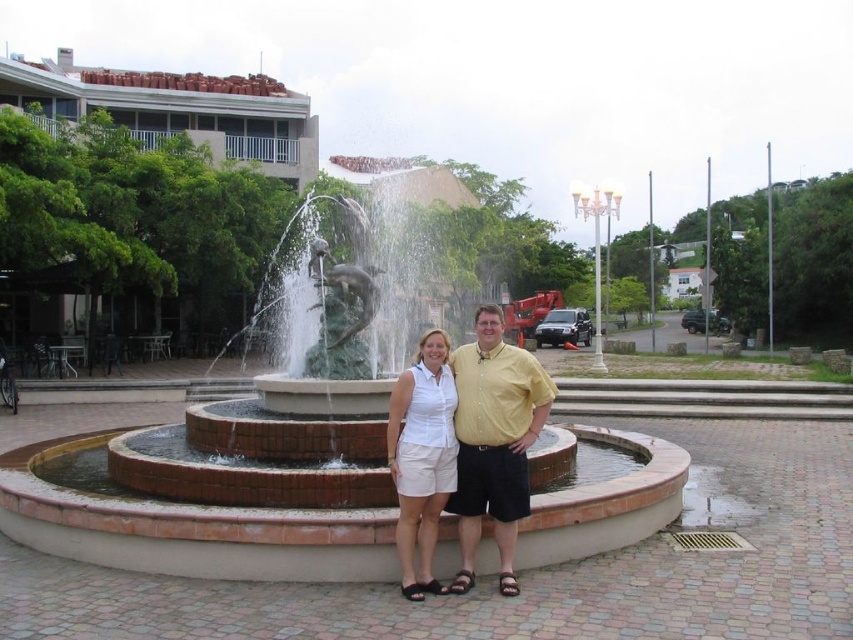
Question: Which object appears farthest from the camera in this image?

Choices:
 (A) yellow cotton shirt at center
 (B) white cotton shorts at center

Answer: (A)

Question: Is brick fountain at center thinner than yellow cotton shirt at center?

Choices:
 (A) no
 (B) yes

Answer: (A)

Question: Considering the real-world distances, which object is closest to the white cotton shorts at center?

Choices:
 (A) yellow cotton shirt at center
 (B) brick fountain at center

Answer: (A)

Question: Is brick fountain at center in front of white cotton shorts at center?

Choices:
 (A) yes
 (B) no

Answer: (B)

Question: Which of the following is the closest to the observer?

Choices:
 (A) (492, 468)
 (B) (657, 468)
 (C) (444, 480)

Answer: (A)

Question: Can you confirm if brick fountain at center is thinner than white cotton shorts at center?

Choices:
 (A) yes
 (B) no

Answer: (B)